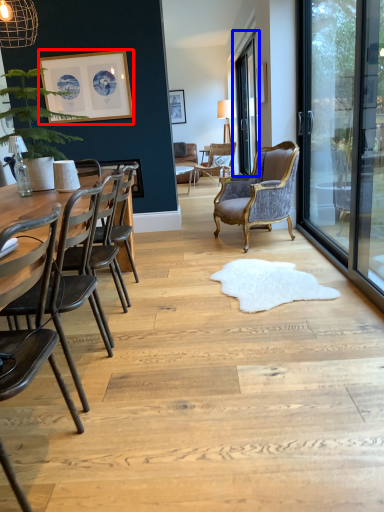
Question: Which of the following is the closest to the observer, picture frame (highlighted by a red box) or window screen (highlighted by a blue box)?

Choices:
 (A) picture frame
 (B) window screen

Answer: (A)